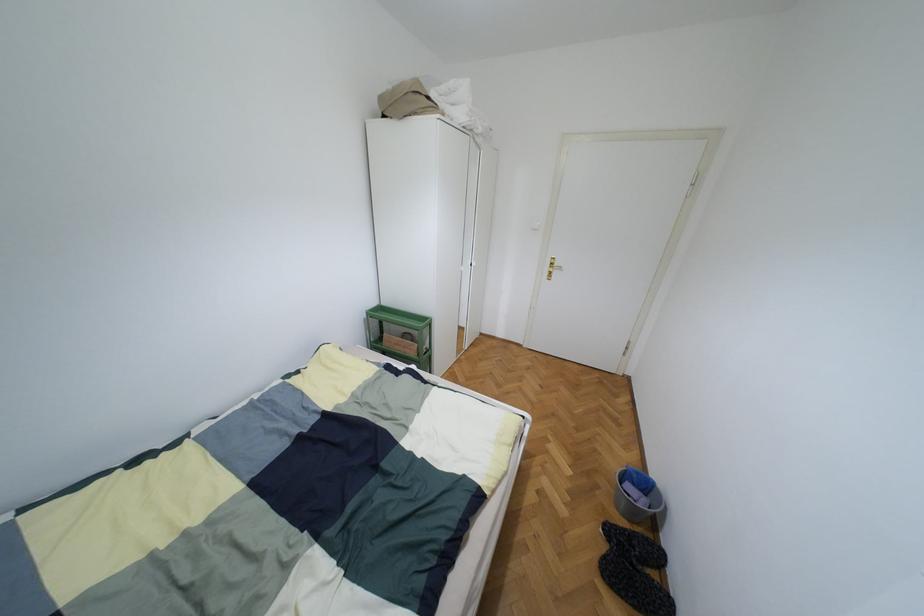
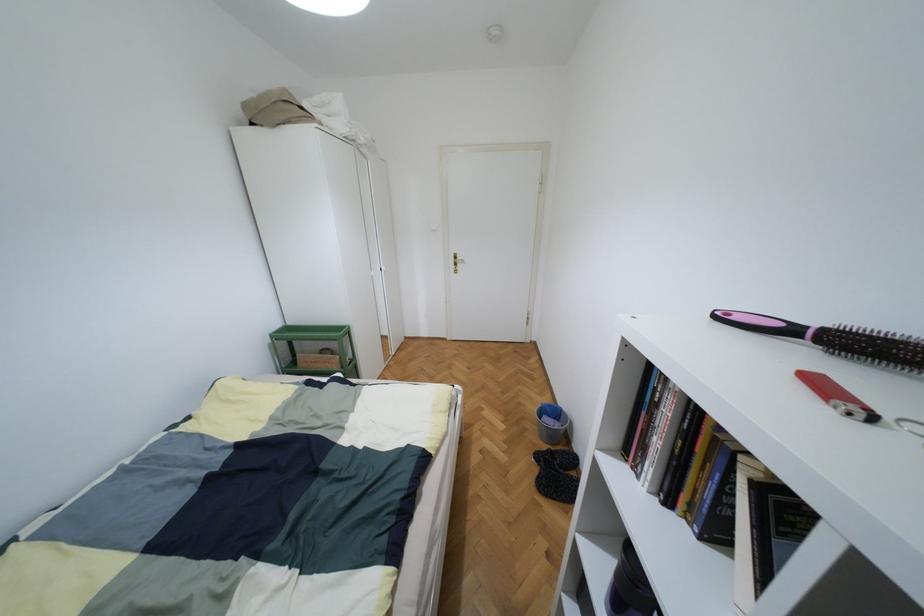
Question: Which direction would the cameraman need to move to produce the second image? Reply with the corresponding letter.

Choices:
 (A) Left
 (B) Right
 (C) Forward
 (D) Backward

Answer: (D)